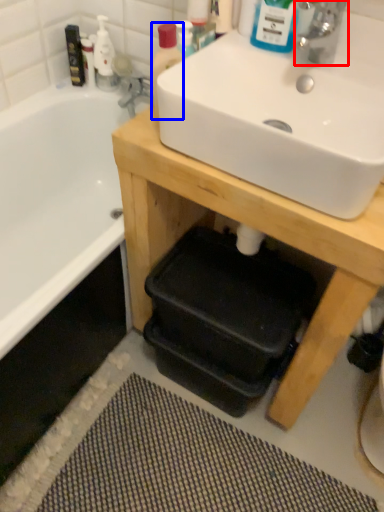
Question: Among these objects, which one is nearest to the camera, tap (highlighted by a red box) or bottle (highlighted by a blue box)?

Choices:
 (A) tap
 (B) bottle

Answer: (A)